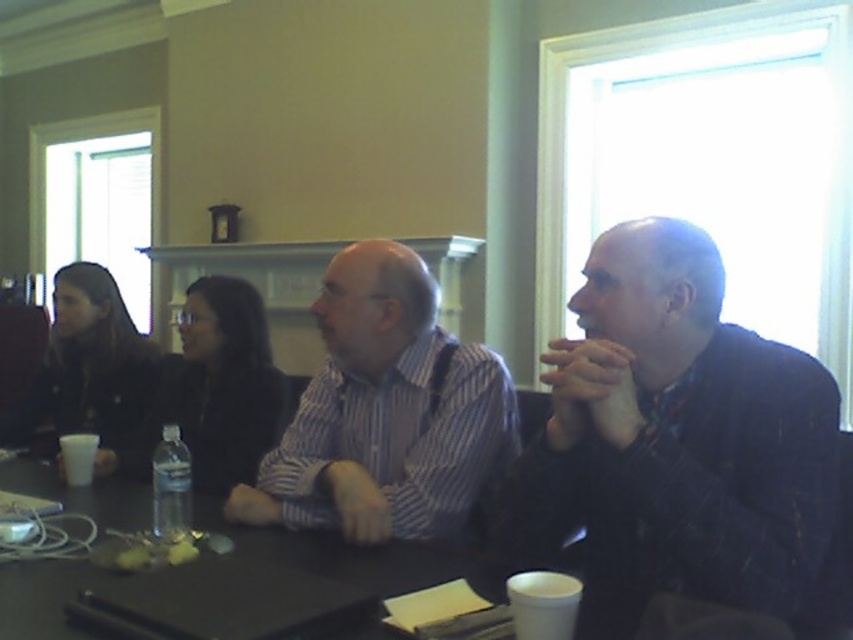
Question: Does striped cotton shirt at center appear on the left side of clear plastic bottle at table center?

Choices:
 (A) yes
 (B) no

Answer: (B)

Question: Which point is farther to the camera?

Choices:
 (A) (296, 426)
 (B) (164, 484)
 (C) (699, 410)

Answer: (A)

Question: Is dark textured jacket at right to the right of striped cotton shirt at center from the viewer's perspective?

Choices:
 (A) yes
 (B) no

Answer: (A)

Question: Which object is farther from the camera taking this photo?

Choices:
 (A) striped cotton shirt at center
 (B) clear plastic bottle at table center

Answer: (A)

Question: Which of the following is the closest to the observer?

Choices:
 (A) clear plastic bottle at table center
 (B) striped cotton shirt at center
 (C) dark textured jacket at right

Answer: (C)

Question: Can you confirm if dark textured jacket at right is positioned above clear plastic bottle at table center?

Choices:
 (A) no
 (B) yes

Answer: (B)